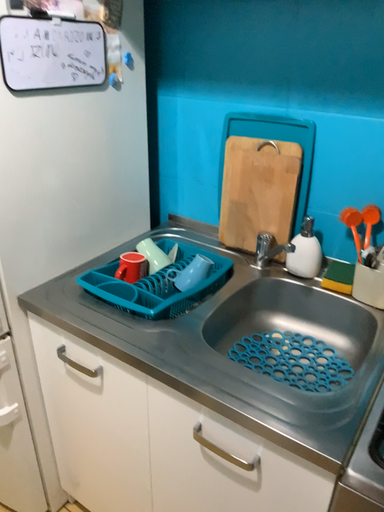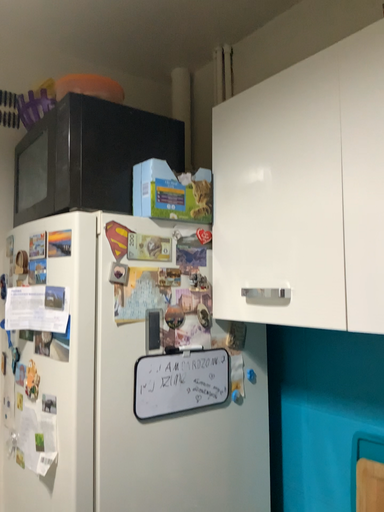
Question: How did the camera likely rotate when shooting the video?

Choices:
 (A) rotated upward
 (B) rotated downward

Answer: (A)